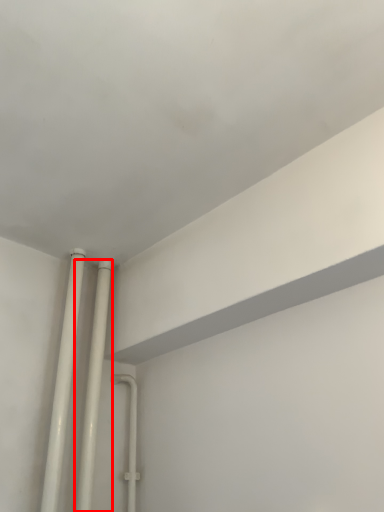
Question: From the image's perspective, where is pipe (annotated by the red box) located relative to pipe?

Choices:
 (A) below
 (B) above

Answer: (A)